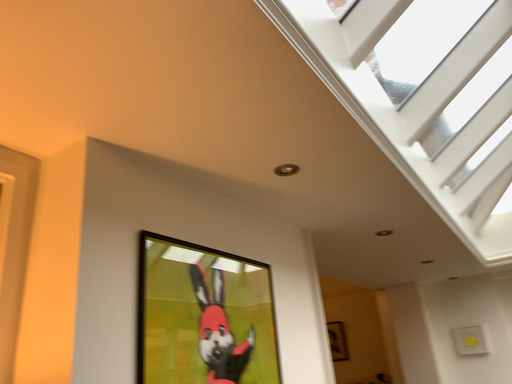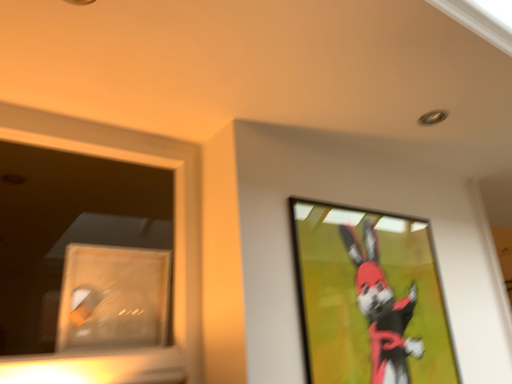
Question: How did the camera likely rotate when shooting the video?

Choices:
 (A) rotated downward
 (B) rotated upward

Answer: (A)